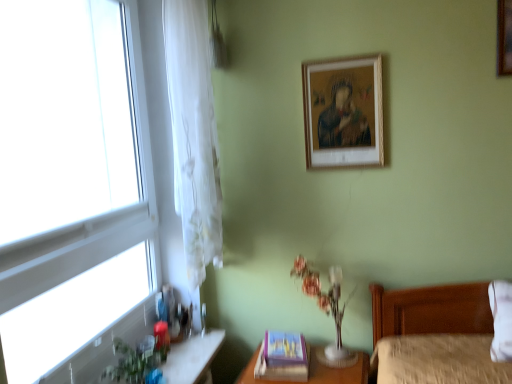
Question: Does white sheer curtain at left turn towards translucent glass vanity at lower left?

Choices:
 (A) no
 (B) yes

Answer: (A)

Question: Does white sheer curtain at left have a larger size compared to translucent glass vanity at lower left?

Choices:
 (A) no
 (B) yes

Answer: (B)

Question: Does white sheer curtain at left touch translucent glass vanity at lower left?

Choices:
 (A) yes
 (B) no

Answer: (B)

Question: Is translucent glass vanity at lower left inside white sheer curtain at left?

Choices:
 (A) yes
 (B) no

Answer: (B)

Question: Considering the relative sizes of white sheer curtain at left and translucent glass vanity at lower left in the image provided, is white sheer curtain at left wider than translucent glass vanity at lower left?

Choices:
 (A) no
 (B) yes

Answer: (A)

Question: Considering the relative sizes of white sheer curtain at left and translucent glass vanity at lower left in the image provided, is white sheer curtain at left thinner than translucent glass vanity at lower left?

Choices:
 (A) no
 (B) yes

Answer: (B)

Question: Is translucent glass vase at center taller than wooden picture frame at upper right, acting as the third picture frame starting from the bottom?

Choices:
 (A) no
 (B) yes

Answer: (B)

Question: From a real-world perspective, is translucent glass vase at center positioned over wooden picture frame at upper right, the first picture frame positioned from the right, based on gravity?

Choices:
 (A) yes
 (B) no

Answer: (B)

Question: Is translucent glass vase at center thinner than wooden picture frame at upper right, acting as the third picture frame starting from the bottom?

Choices:
 (A) no
 (B) yes

Answer: (A)

Question: From a real-world perspective, is translucent glass vase at center below wooden picture frame at upper right, the third picture frame when ordered from left to right?

Choices:
 (A) no
 (B) yes

Answer: (B)

Question: Can you confirm if translucent glass vase at center is bigger than wooden picture frame at upper right, which is the 1th picture frame from top to bottom?

Choices:
 (A) yes
 (B) no

Answer: (A)

Question: Can you confirm if translucent glass vase at center is shorter than wooden picture frame at upper right, acting as the third picture frame starting from the bottom?

Choices:
 (A) no
 (B) yes

Answer: (A)

Question: From a real-world perspective, does wooden picture frame at upper right, which is the 1th picture frame from top to bottom, sit lower than translucent glass vase at center?

Choices:
 (A) no
 (B) yes

Answer: (A)